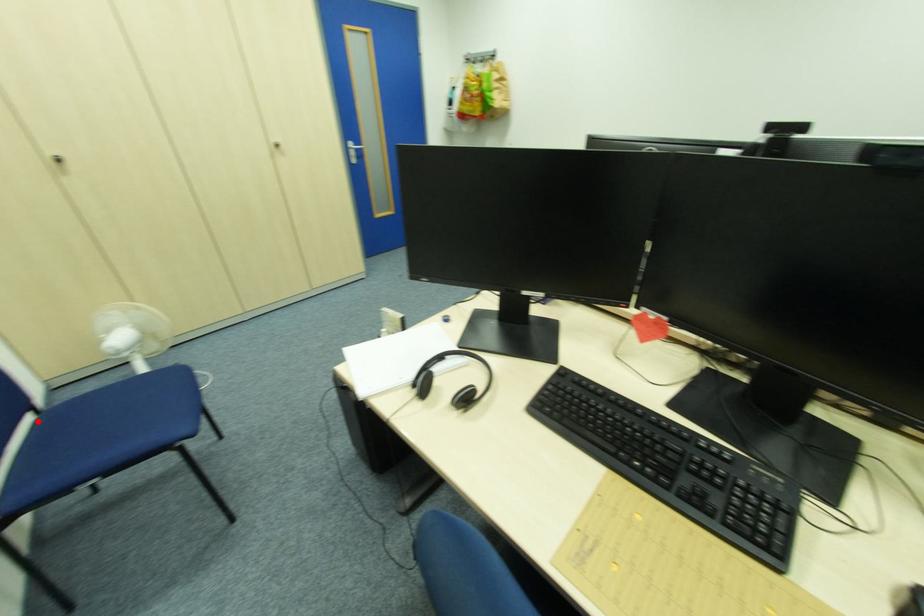
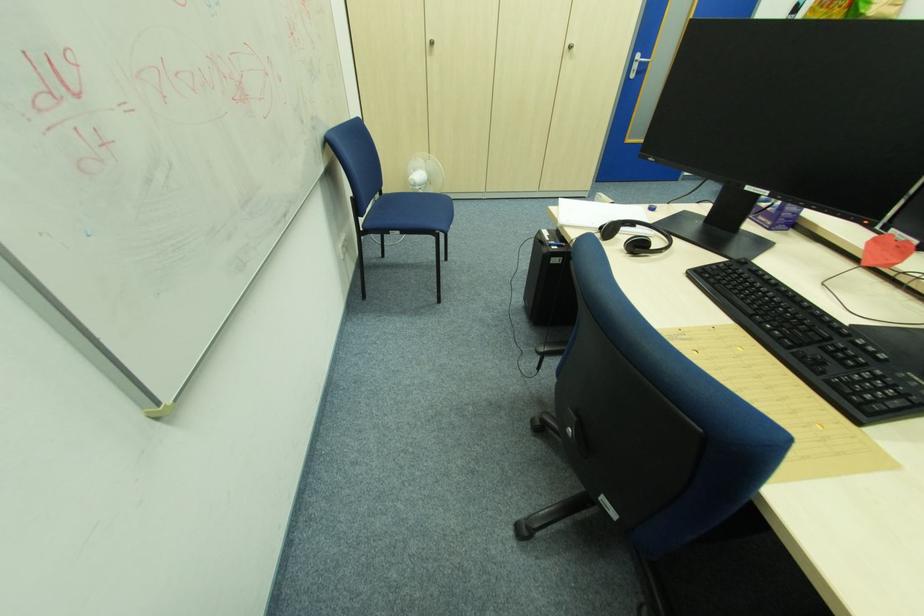
Question: I am providing you with two images of the same scene from different viewpoints. A red point is marked on the first image. Can you still see the location of the red point in image 2?

Choices:
 (A) Yes
 (B) No

Answer: (A)